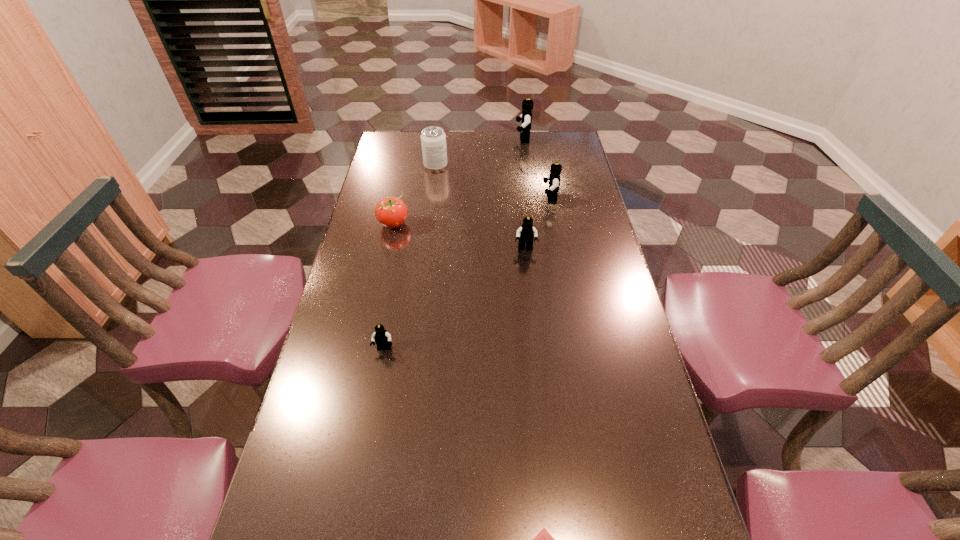
This screenshot has height=540, width=960. Identify the location of black Lego identified as the closest to the second nearest black Lego. (554, 178).

The image size is (960, 540). I want to click on black Lego that is the third nearest to the farthest Lego, so click(382, 338).

Where is `blank area in the image that satisfies the following two spatial constraints: 1. on the front-facing side of the farthest Lego; 2. on the front-facing side of the second smallest black Lego`? The height and width of the screenshot is (540, 960). blank area in the image that satisfies the following two spatial constraints: 1. on the front-facing side of the farthest Lego; 2. on the front-facing side of the second smallest black Lego is located at coordinates [538, 248].